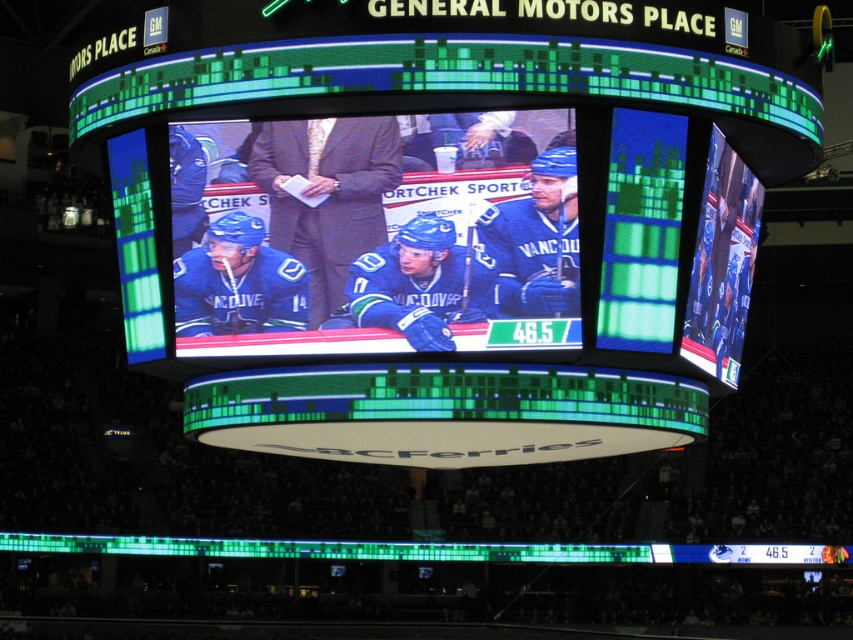
Question: Is matte black scoreboard at center to the right of blue jersey hockey players at center from the viewer's perspective?

Choices:
 (A) no
 (B) yes

Answer: (B)

Question: Is matte black scoreboard at center in front of blue jersey hockey players at center?

Choices:
 (A) no
 (B) yes

Answer: (B)

Question: Which point is closer to the camera?

Choices:
 (A) (357, 344)
 (B) (558, 337)

Answer: (B)

Question: Observing the image, what is the correct spatial positioning of matte black scoreboard at center in reference to blue jersey hockey players at center?

Choices:
 (A) above
 (B) below

Answer: (B)